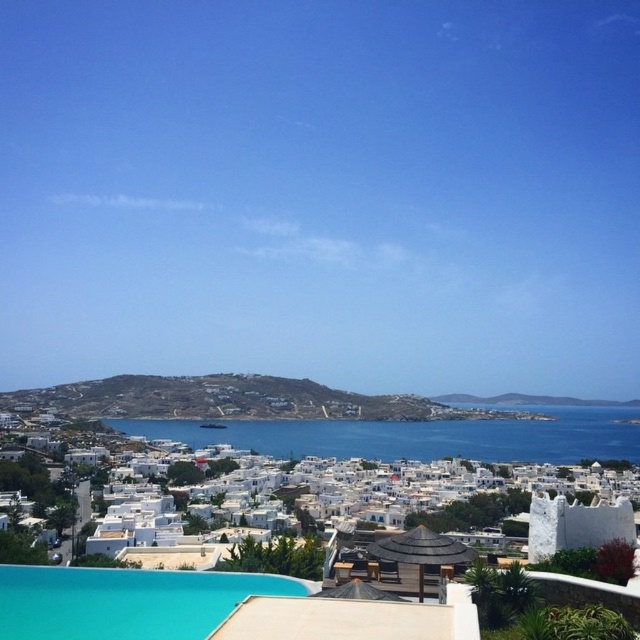
Question: Which object is closer to the camera taking this photo?

Choices:
 (A) blue water at center
 (B) turquoise glossy pool at lower center

Answer: (B)

Question: Is blue water at center to the left of turquoise glossy pool at lower center from the viewer's perspective?

Choices:
 (A) no
 (B) yes

Answer: (A)

Question: Can you confirm if blue water at center is positioned to the right of turquoise glossy pool at lower center?

Choices:
 (A) yes
 (B) no

Answer: (A)

Question: Which point is closer to the camera?

Choices:
 (A) (211, 435)
 (B) (36, 577)

Answer: (B)

Question: Which object is farther from the camera taking this photo?

Choices:
 (A) blue water at center
 (B) turquoise glossy pool at lower center

Answer: (A)

Question: Can you confirm if blue water at center is thinner than turquoise glossy pool at lower center?

Choices:
 (A) no
 (B) yes

Answer: (A)